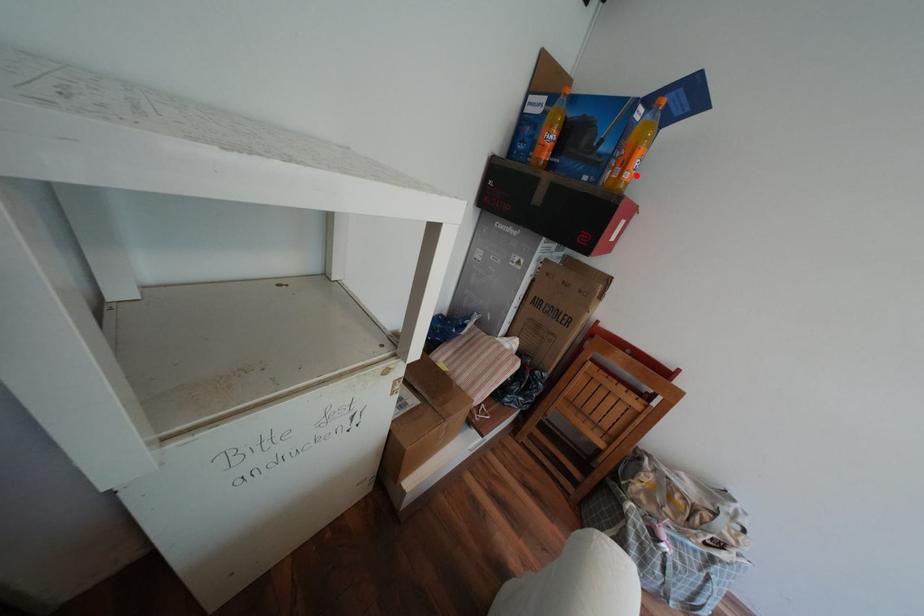
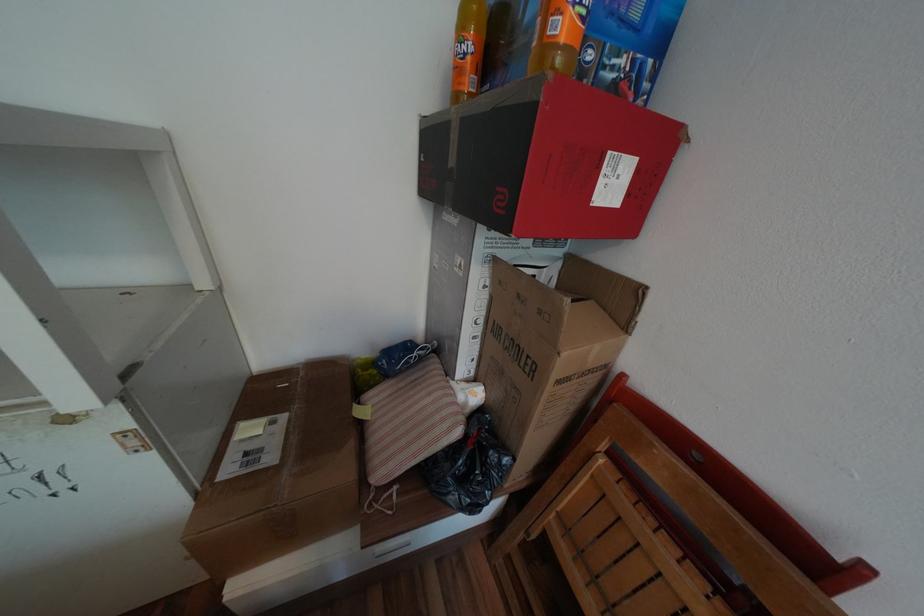
Find the pixel in the second image that matches the highlighted location in the first image.

(569, 26)